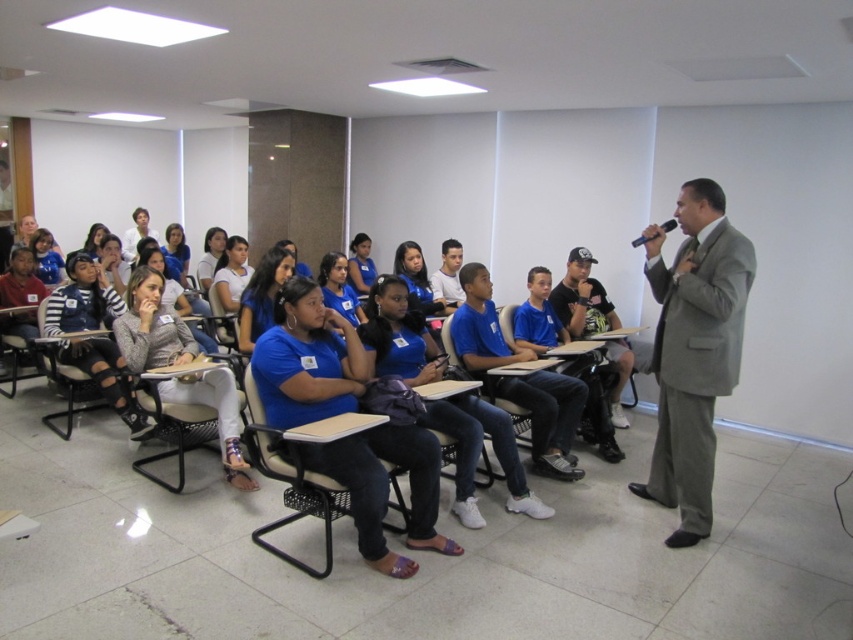
You are a student sitting at the desk in the back row of the classroom. You need to locate the speaker wearing the gray suit at right. Where should you look in terms of coordinates?

The gray suit at right is located at coordinates point (693,349).